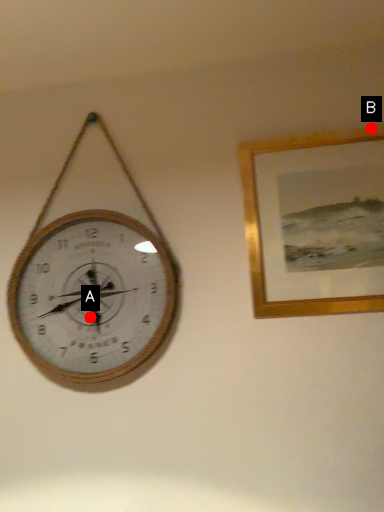
Question: Two points are circled on the image, labeled by A and B beside each circle. Which point is closer to the camera?

Choices:
 (A) A is closer
 (B) B is closer

Answer: (A)